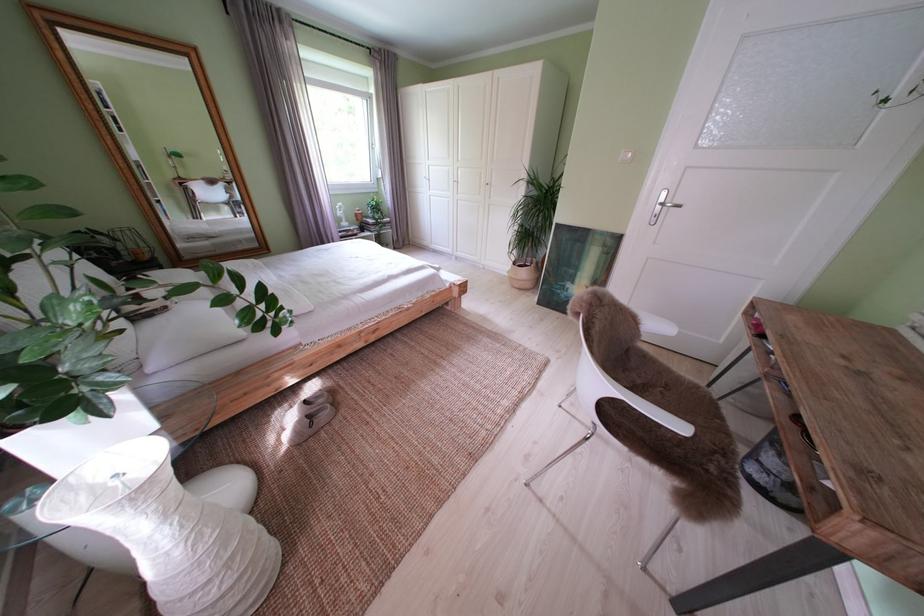
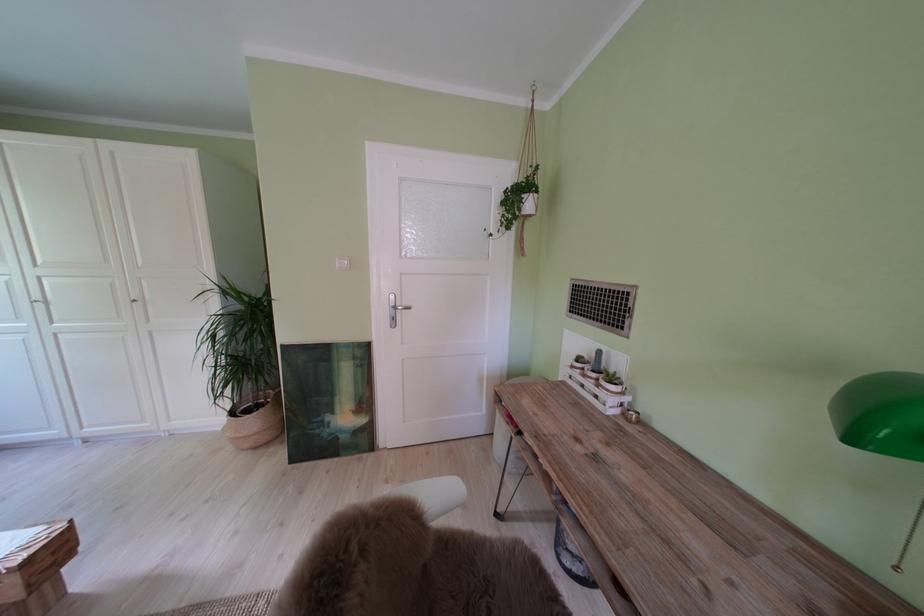
Locate, in the second image, the point that corresponds to pixel 570 297 in the first image.

(329, 437)